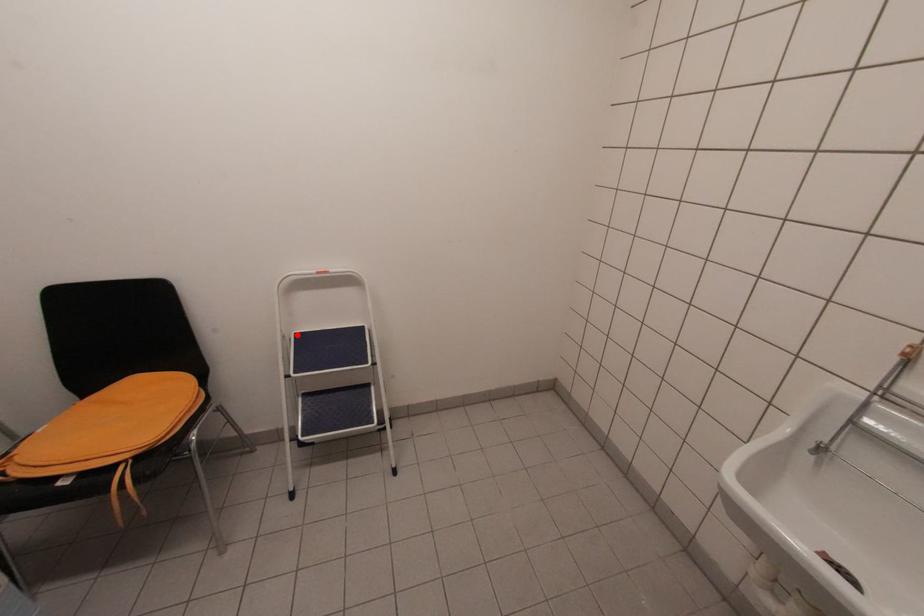
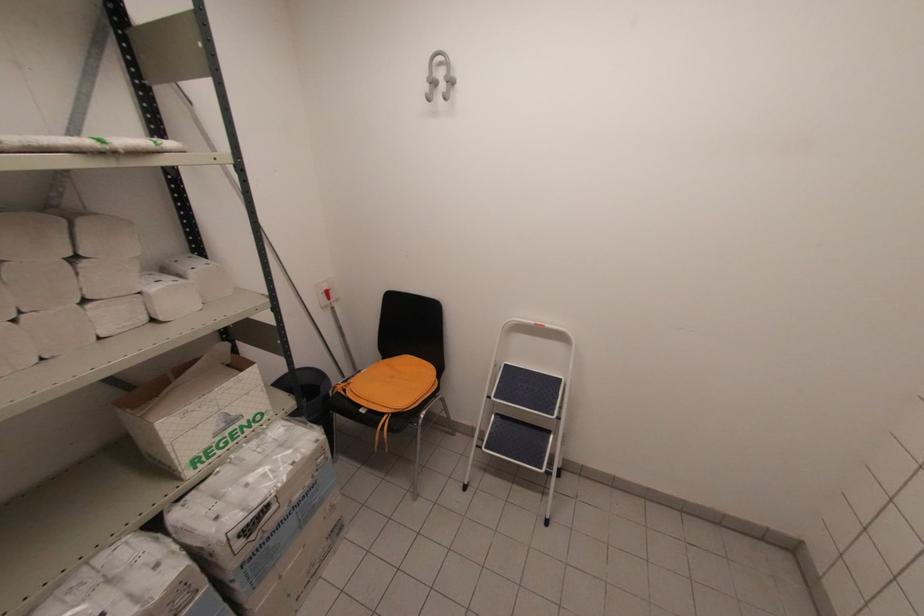
The point at the highlighted location is marked in the first image. Where is the corresponding point in the second image?

(506, 366)